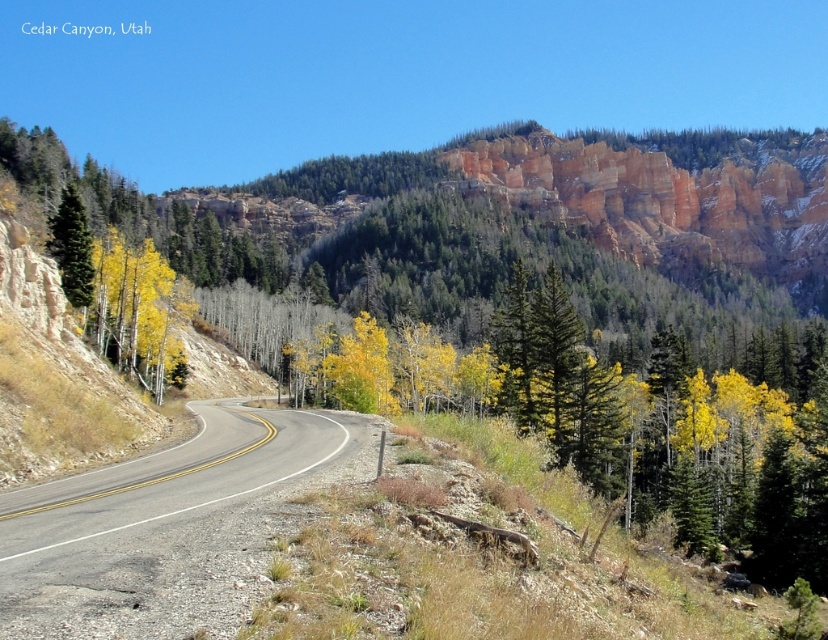
You are standing at the point closer to the camera in the image. Which point are you at, point (x=331, y=212) or point (x=75, y=248)?

You are at point (x=331, y=212) because it is further to the camera than point (x=75, y=248).